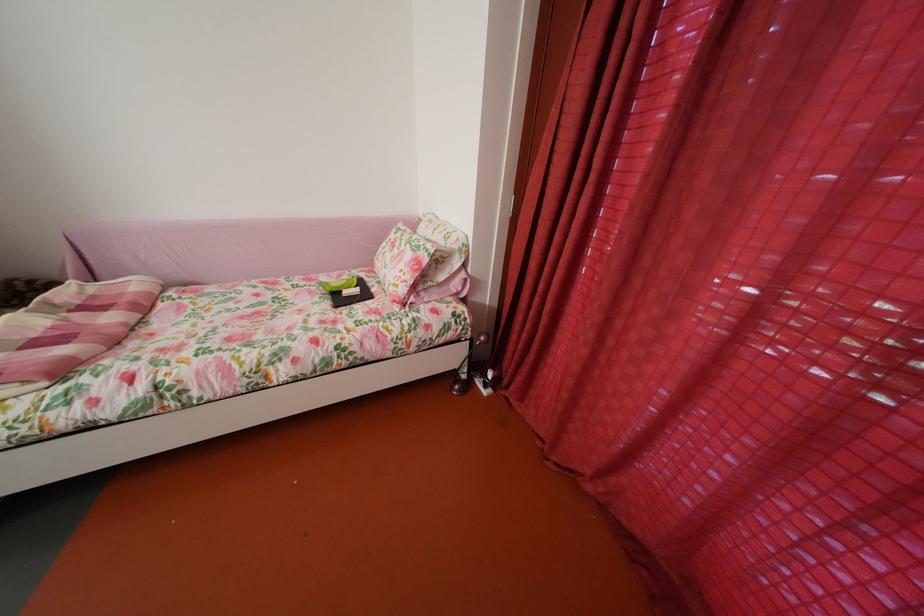
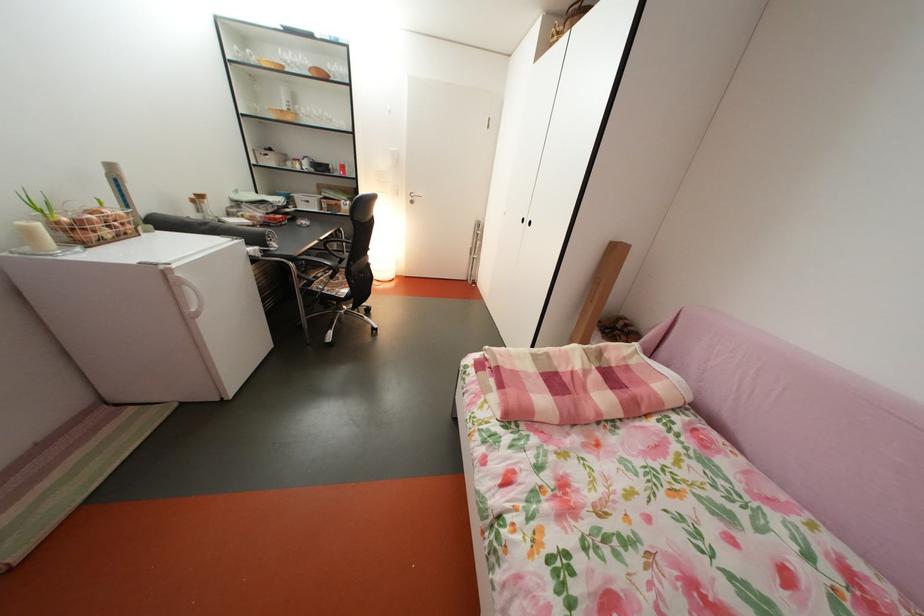
How did the camera likely rotate?

The camera's rotation is toward left-down.